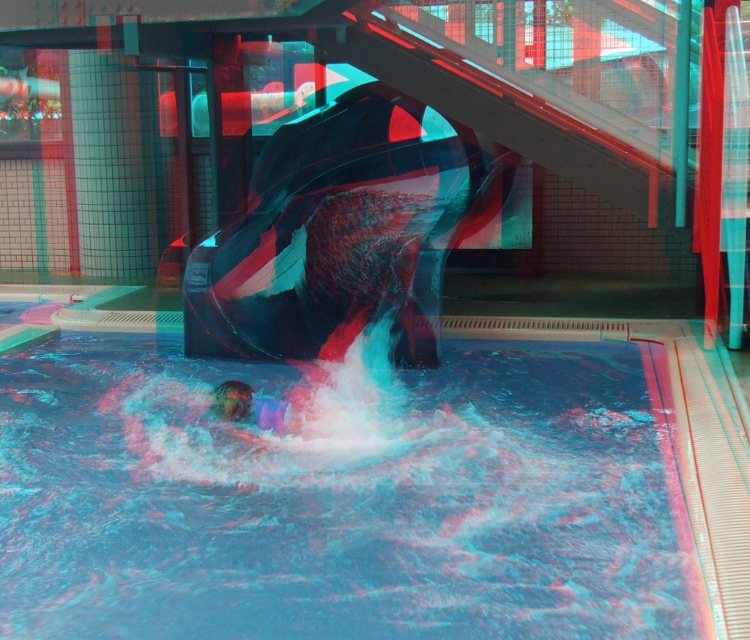
Can you confirm if blue rubber pool at center is positioned below translucent purple swimmer at center?

Indeed, blue rubber pool at center is positioned under translucent purple swimmer at center.

Is point (615, 500) farther from camera compared to point (213, 401)?

That is False.

In order to click on blue rubber pool at center in this screenshot , I will do `click(375, 493)`.